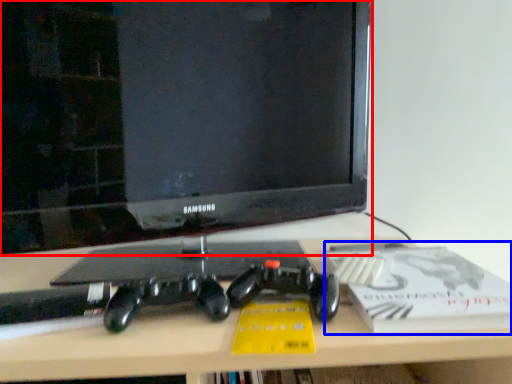
Question: Among these objects, which one is nearest to the camera, television (highlighted by a red box) or paperback book (highlighted by a blue box)?

Choices:
 (A) television
 (B) paperback book

Answer: (B)